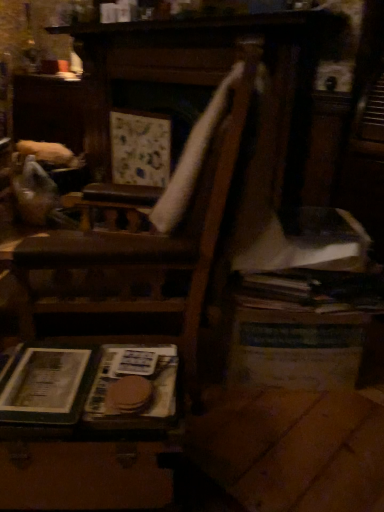
Identify the location of vacant region above hardcover book at lower left, acting as the first paperback book starting from the left (from a real-world perspective). (46, 373).